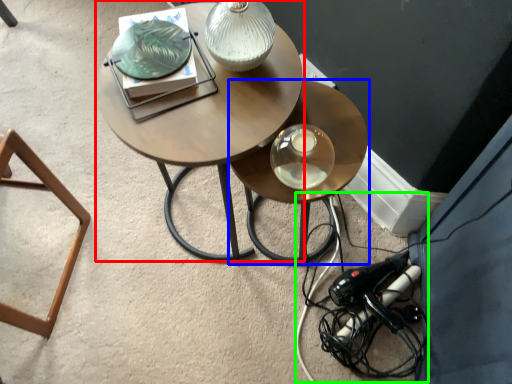
Question: Which is nearer to the coffee table (highlighted by a red box)? table (highlighted by a blue box) or cable (highlighted by a green box).

Choices:
 (A) table
 (B) cable

Answer: (A)